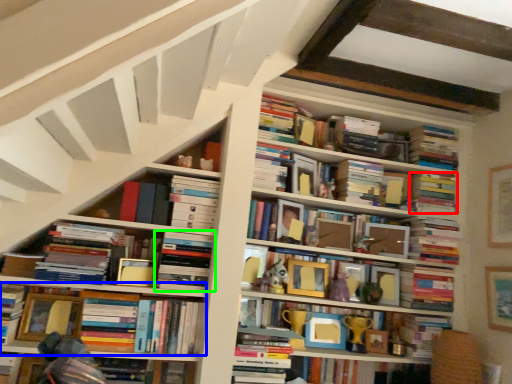
Question: Based on their relative distances, which object is farther from book (highlighted by a red box)? Choose from book (highlighted by a blue box) and book (highlighted by a green box).

Choices:
 (A) book
 (B) book

Answer: (A)